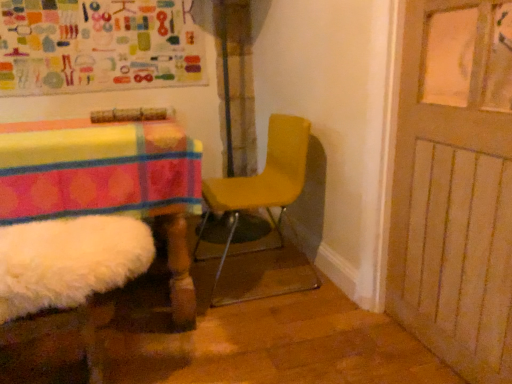
Question: Can colorful fabric bulletin board at upper left be found inside wooden door at right?

Choices:
 (A) no
 (B) yes

Answer: (A)

Question: From a real-world perspective, does wooden door at right stand above colorful fabric bulletin board at upper left?

Choices:
 (A) yes
 (B) no

Answer: (B)

Question: Does wooden door at right have a greater height compared to colorful fabric bulletin board at upper left?

Choices:
 (A) yes
 (B) no

Answer: (A)

Question: Considering the relative sizes of wooden door at right and colorful fabric bulletin board at upper left in the image provided, is wooden door at right bigger than colorful fabric bulletin board at upper left?

Choices:
 (A) yes
 (B) no

Answer: (B)

Question: Does wooden door at right lie in front of colorful fabric bulletin board at upper left?

Choices:
 (A) no
 (B) yes

Answer: (B)

Question: From the image's perspective, is colorful fabric bulletin board at upper left located above or below wooden door at right?

Choices:
 (A) below
 (B) above

Answer: (B)

Question: Is colorful fabric bulletin board at upper left inside the boundaries of wooden door at right, or outside?

Choices:
 (A) inside
 (B) outside

Answer: (B)

Question: Considering the positions of point (169, 77) and point (468, 115), is point (169, 77) closer or farther from the camera than point (468, 115)?

Choices:
 (A) closer
 (B) farther

Answer: (B)

Question: In the image, is colorful fabric bulletin board at upper left on the left side or the right side of wooden door at right?

Choices:
 (A) left
 (B) right

Answer: (A)

Question: From a real-world perspective, relative to colorful fabric bulletin board at upper left, is wooden door at right vertically above or below?

Choices:
 (A) above
 (B) below

Answer: (B)

Question: Considering the positions of point (395, 205) and point (52, 84), is point (395, 205) closer or farther from the camera than point (52, 84)?

Choices:
 (A) farther
 (B) closer

Answer: (B)

Question: Is wooden door at right taller or shorter than colorful fabric bulletin board at upper left?

Choices:
 (A) short
 (B) tall

Answer: (B)

Question: Is wooden door at right bigger or smaller than colorful fabric bulletin board at upper left?

Choices:
 (A) big
 (B) small

Answer: (B)

Question: Based on their sizes in the image, would you say yellow matte chair at center is bigger or smaller than wooden door at right?

Choices:
 (A) big
 (B) small

Answer: (A)

Question: From the image's perspective, is yellow matte chair at center above or below wooden door at right?

Choices:
 (A) below
 (B) above

Answer: (A)